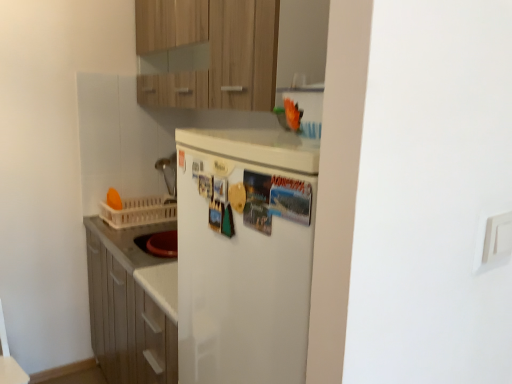
Question: Can you confirm if wooden cabinet at upper center is wider than white plastic basket at left?

Choices:
 (A) no
 (B) yes

Answer: (A)

Question: Considering the relative sizes of wooden cabinet at upper center and white plastic basket at left in the image provided, is wooden cabinet at upper center bigger than white plastic basket at left?

Choices:
 (A) no
 (B) yes

Answer: (B)

Question: From a real-world perspective, is wooden cabinet at upper center over white plastic basket at left?

Choices:
 (A) yes
 (B) no

Answer: (A)

Question: Is wooden cabinet at upper center positioned with its back to white plastic basket at left?

Choices:
 (A) no
 (B) yes

Answer: (A)

Question: Is the depth of wooden cabinet at upper center greater than that of white plastic basket at left?

Choices:
 (A) yes
 (B) no

Answer: (B)

Question: Considering the positions of wooden cabinet at upper center and white matte refrigerator at center in the image, is wooden cabinet at upper center wider or thinner than white matte refrigerator at center?

Choices:
 (A) wide
 (B) thin

Answer: (A)

Question: Does point (260, 59) appear closer or farther from the camera than point (193, 139)?

Choices:
 (A) farther
 (B) closer

Answer: (A)

Question: In terms of height, does wooden cabinet at upper center look taller or shorter compared to white matte refrigerator at center?

Choices:
 (A) tall
 (B) short

Answer: (A)

Question: From a real-world perspective, is wooden cabinet at upper center above or below white matte refrigerator at center?

Choices:
 (A) above
 (B) below

Answer: (A)

Question: Considering their positions, is white matte refrigerator at center located in front of or behind white plastic basket at left?

Choices:
 (A) front
 (B) behind

Answer: (A)

Question: Considering the positions of white matte refrigerator at center and white plastic basket at left in the image, is white matte refrigerator at center taller or shorter than white plastic basket at left?

Choices:
 (A) short
 (B) tall

Answer: (B)

Question: Is point (273, 192) positioned closer to the camera than point (111, 223)?

Choices:
 (A) closer
 (B) farther

Answer: (A)

Question: Is white matte refrigerator at center spatially inside white plastic basket at left, or outside of it?

Choices:
 (A) inside
 (B) outside

Answer: (B)

Question: Is point (126, 203) positioned closer to the camera than point (195, 104)?

Choices:
 (A) farther
 (B) closer

Answer: (A)

Question: Based on their sizes in the image, would you say white plastic basket at left is bigger or smaller than wooden cabinet at upper center?

Choices:
 (A) small
 (B) big

Answer: (A)